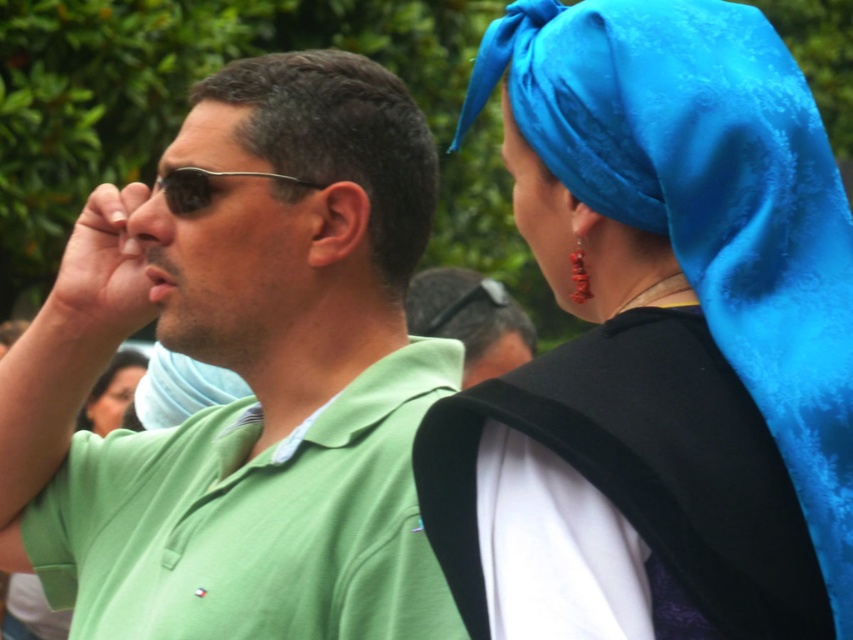
You are a photographer trying to capture a closeup shot of the matte black sunglasses at left and the smooth black hair at lower left. Which object should you zoom in more on to ensure both are in focus?

The matte black sunglasses at left is smaller than the smooth black hair at lower left, so you should zoom in more on the matte black sunglasses at left to ensure both are in focus.

You are a photographer trying to capture a closeup shot of the matte black forehead at upper center without including the smooth black hair at lower left in the frame. Based on their positions, is this possible?

The matte black forehead at upper center is closer to the viewer than the smooth black hair at lower left, so yes, it is possible to focus on the matte black forehead at upper center without including the smooth black hair at lower left in the frame.